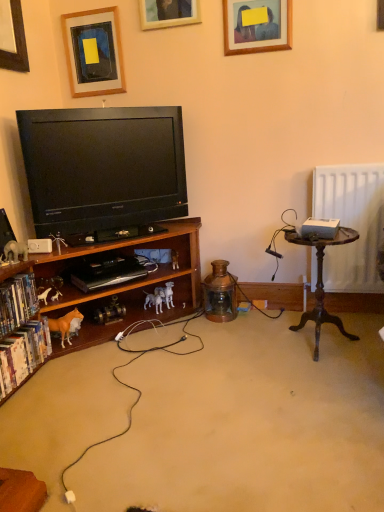
Image resolution: width=384 pixels, height=512 pixels. In order to click on free space that is in between brown matte horse at lower left and copper glass lantern at center, which is the first toy from right to left in this screenshot , I will do `click(163, 331)`.